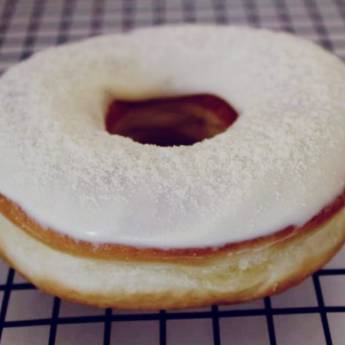
Where is `checkered table cloth`? The image size is (345, 345). checkered table cloth is located at coordinates (303, 303), (241, 327).